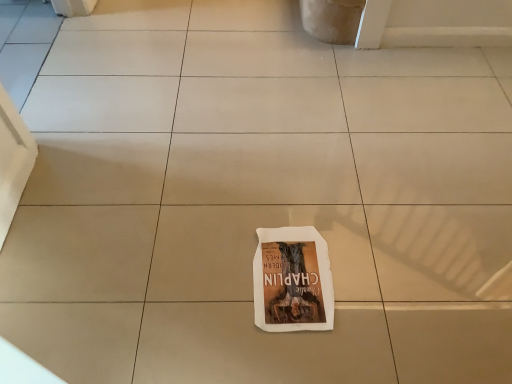
This screenshot has height=384, width=512. Identify the location of vacant space to the right of white paper magazine at center. click(376, 274).